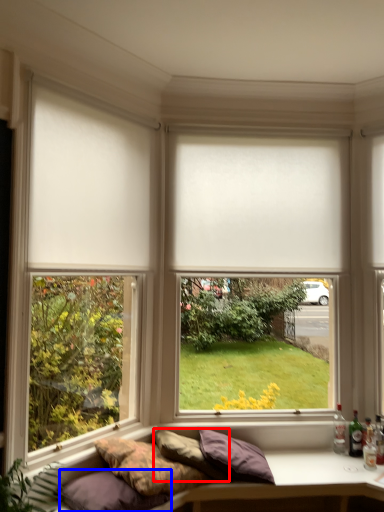
Question: Which object appears closest to the camera in this image, pillow (highlighted by a red box) or pillow (highlighted by a blue box)?

Choices:
 (A) pillow
 (B) pillow

Answer: (B)